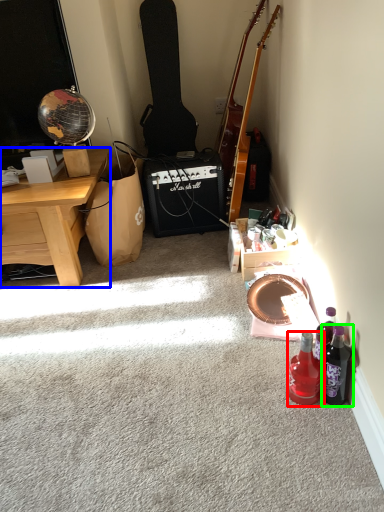
Question: Which object is positioned farthest from bottle (highlighted by a red box)? Select from desk (highlighted by a blue box) and bottle (highlighted by a green box).

Choices:
 (A) desk
 (B) bottle

Answer: (A)